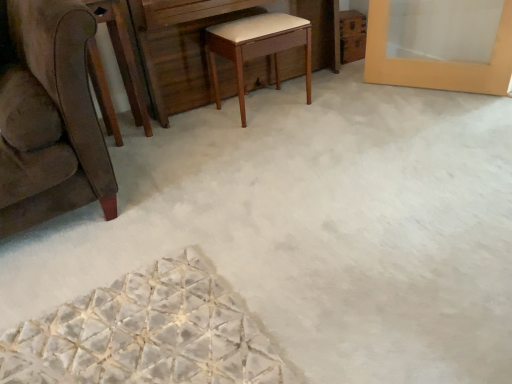
Question: Is light brown wood stool at center taller or shorter than wooden vanity at center?

Choices:
 (A) tall
 (B) short

Answer: (B)

Question: Looking at their shapes, would you say light brown wood stool at center is wider or thinner than wooden vanity at center?

Choices:
 (A) wide
 (B) thin

Answer: (B)

Question: Considering the real-world distances, which object is closest to the brown wood round table at left?

Choices:
 (A) light brown wood stool at center
 (B) wooden vanity at center

Answer: (B)

Question: Which object is the closest to the brown wood round table at left?

Choices:
 (A) light brown wood stool at center
 (B) wooden vanity at center

Answer: (B)